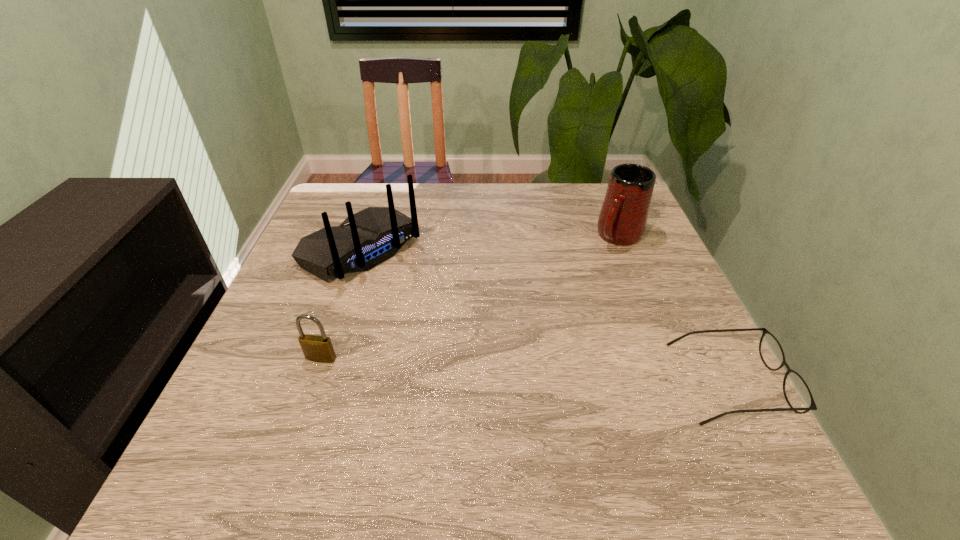
Locate an element on the screen. object situated at the near right corner is located at coordinates (797, 393).

Image resolution: width=960 pixels, height=540 pixels. In the image, there is a desktop. What are the coordinates of `vacant space at the far edge` in the screenshot? It's located at (459, 193).

Identify the location of vacant space at the near edge. The image size is (960, 540). (476, 428).

Image resolution: width=960 pixels, height=540 pixels. What are the coordinates of `vacant area at the left edge of the desktop` in the screenshot? It's located at click(x=269, y=361).

In the image, there is a desktop. Identify the location of vacant space at the right edge. This screenshot has height=540, width=960. (611, 275).

In the image, there is a desktop. Where is `vacant space at the far left corner`? This screenshot has height=540, width=960. vacant space at the far left corner is located at coordinates (361, 198).

This screenshot has height=540, width=960. In the image, there is a desktop. Identify the location of vacant area at the near left corner. (233, 416).

Find the location of a particular element. The width and height of the screenshot is (960, 540). vacant space that's between the mug and the shortest object is located at coordinates (674, 309).

At what (x,y) coordinates should I click in order to perform the action: click on vacant space that is in between the shortest object and the mug. Please return your answer as a coordinate pair (x, y). Image resolution: width=960 pixels, height=540 pixels. Looking at the image, I should click on (674, 309).

This screenshot has width=960, height=540. What are the coordinates of `free spot between the shortest object and the mug` in the screenshot? It's located at (674, 309).